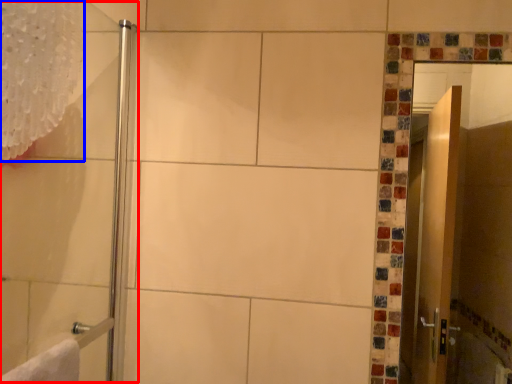
Question: Which point is further to the camera, shower door (highlighted by a red box) or shower curtain (highlighted by a blue box)?

Choices:
 (A) shower door
 (B) shower curtain

Answer: (B)